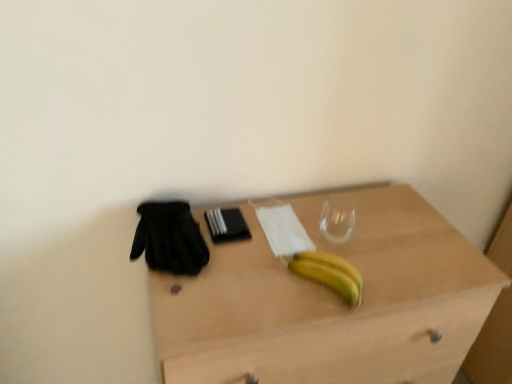
Locate an element on the screen. The height and width of the screenshot is (384, 512). vacant space in front of black mesh glove at left is located at coordinates (193, 304).